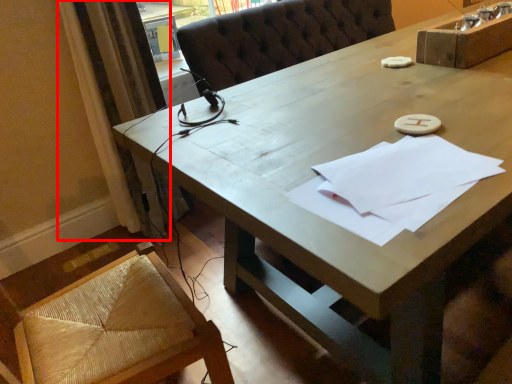
Question: From the image's perspective, where is curtain (annotated by the red box) located relative to notepad?

Choices:
 (A) above
 (B) below

Answer: (A)